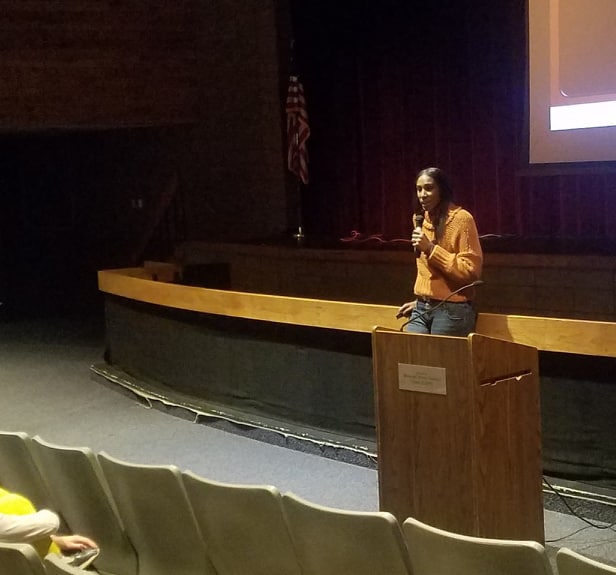
You are a GUI agent. You are given a task and a screenshot of the screen. Output one action in this format:
    pyautogui.click(x=<x>, y=<y>)
    Task: Click on the stage
    Image resolution: width=616 pixels, height=575 pixels.
    Given the screenshot: What is the action you would take?
    pyautogui.click(x=536, y=262)